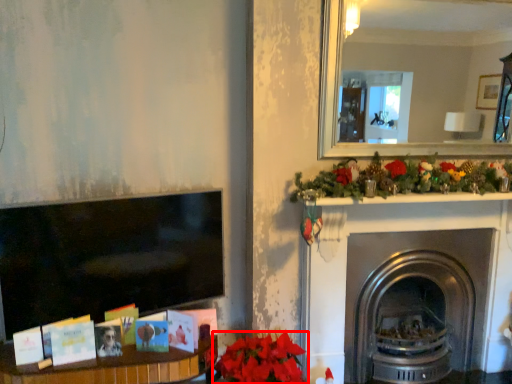
Question: From the image, what is the correct spatial relationship of flower (annotated by the red box) in relation to fireplace?

Choices:
 (A) left
 (B) right

Answer: (A)